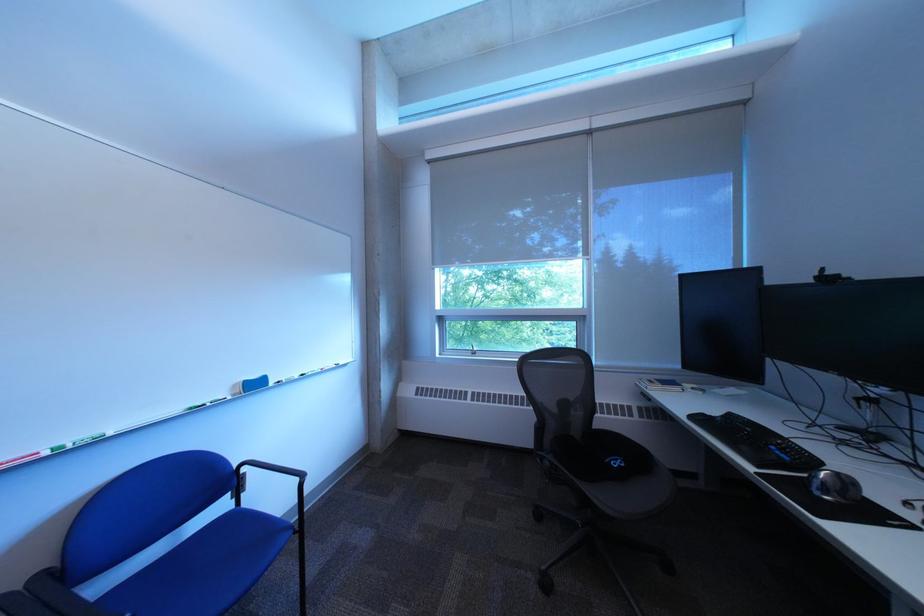
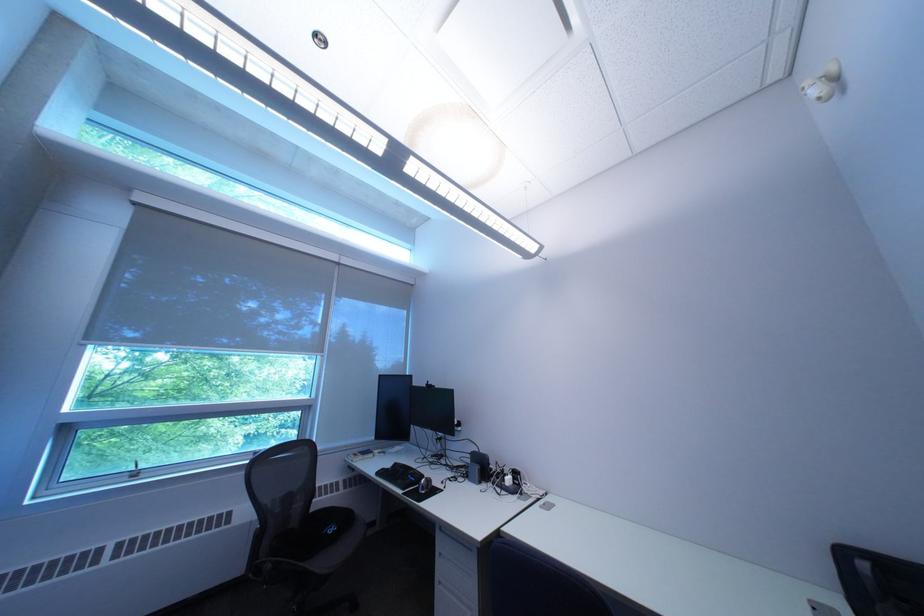
In the second image, find the point that corresponds to (563,464) in the first image.

(285, 568)